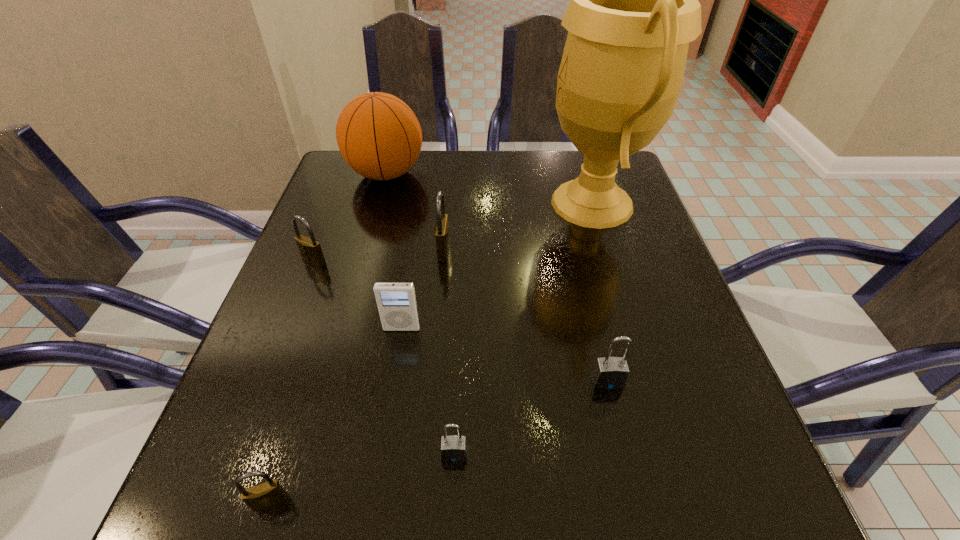
Point out which padlock is positioned as the nearest to the tallest padlock. Please provide its 2D coordinates. Your answer should be formatted as a tuple, i.e. [(x, y)], where the tuple contains the x and y coordinates of a point satisfying the conditions above.

[(310, 250)]

Locate an element on the screen. The height and width of the screenshot is (540, 960). the fourth closest padlock to the second brass padlock from right to left is located at coordinates (442, 239).

Find the location of a particular element. The width and height of the screenshot is (960, 540). the second closest brass padlock to the leftmost brass padlock is located at coordinates (264, 495).

Find the location of a particular element. The height and width of the screenshot is (540, 960). brass padlock that is the second closest to the biggest brass padlock is located at coordinates (264, 495).

Identify the location of free space that satisfies the following two spatial constraints: 1. on the back side of the nearest brass padlock; 2. on the left side of the rightmost brass padlock. This screenshot has width=960, height=540. (348, 251).

Identify the location of free space that satisfies the following two spatial constraints: 1. on the engravings side of the trophy; 2. on the front side of the leftmost brass padlock. (610, 261).

This screenshot has width=960, height=540. Find the location of `free spot that satisfies the following two spatial constraints: 1. on the engravings side of the tallest object; 2. on the shackle of the nearer gray padlock`. free spot that satisfies the following two spatial constraints: 1. on the engravings side of the tallest object; 2. on the shackle of the nearer gray padlock is located at coordinates (668, 454).